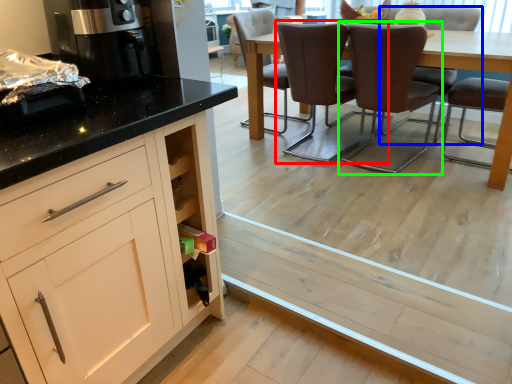
Question: Based on their relative distances, which object is farther from chair (highlighted by a red box)? Choose from chair (highlighted by a blue box) and chair (highlighted by a green box).

Choices:
 (A) chair
 (B) chair

Answer: (A)